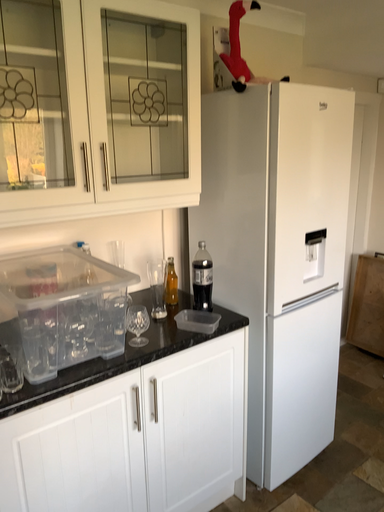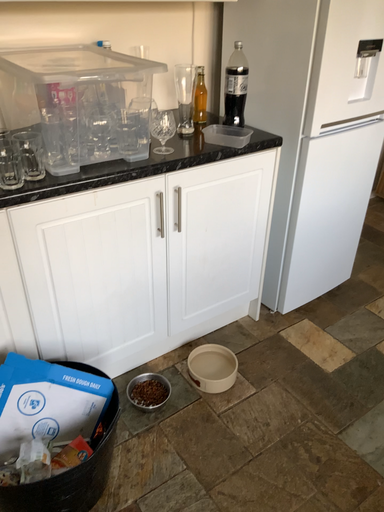
Question: How did the camera likely rotate when shooting the video?

Choices:
 (A) rotated upward
 (B) rotated downward

Answer: (B)